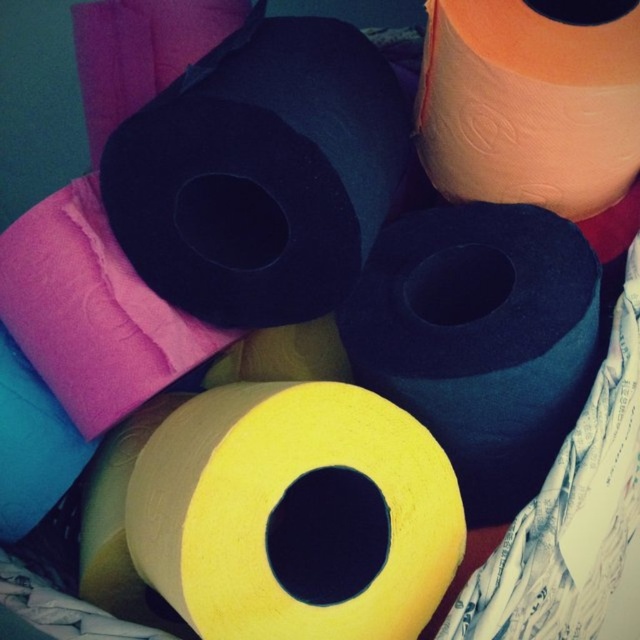
Does yellow matte paper towel at center have a smaller size compared to orange matte paper towel at upper right?

Incorrect, yellow matte paper towel at center is not smaller in size than orange matte paper towel at upper right.

Between point (212, 465) and point (484, 124), which one is positioned behind?

The point (484, 124) is behind.

Is point (198, 412) in front of point (556, 145)?

Yes, it is.

At what (x,y) coordinates should I click in order to perform the action: click on yellow matte paper towel at center. Please return your answer as a coordinate pair (x, y). This screenshot has height=640, width=640. Looking at the image, I should click on coord(276,499).

Locate an element on the screen. yellow matte paper towel at center is located at coordinates (276, 499).

Who is higher up, yellow matte paper towel at center or matte pink pillow at upper left?

matte pink pillow at upper left is higher up.

Does point (230, 561) come behind point (58, 212)?

No.

Locate an element on the screen. yellow matte paper towel at center is located at coordinates (276, 499).

Based on the photo, who is shorter, orange matte paper towel at upper right or matte pink pillow at upper left?

orange matte paper towel at upper right is shorter.

Is point (452, 109) positioned in front of point (48, 208)?

That is False.

The width and height of the screenshot is (640, 640). Identify the location of orange matte paper towel at upper right. (529, 106).